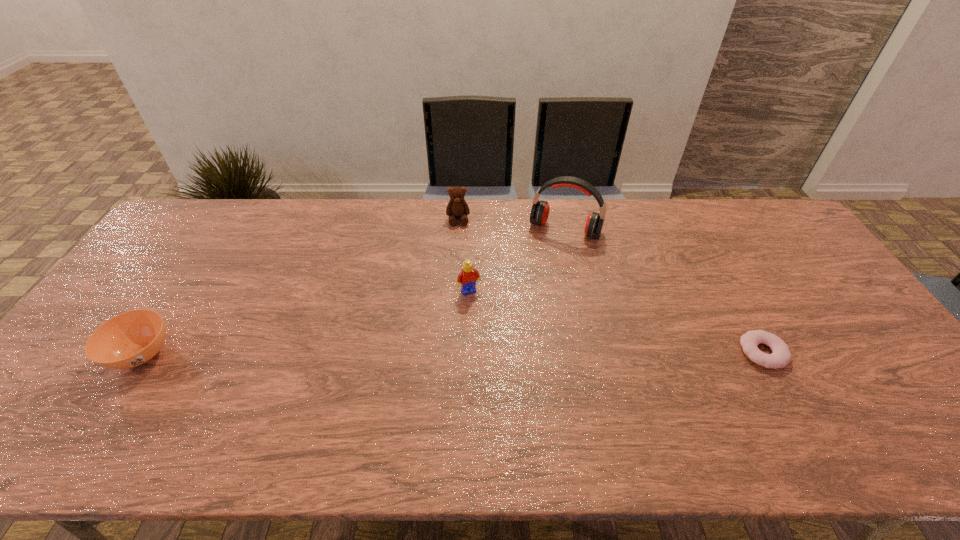
Locate an element on the screen. This screenshot has height=540, width=960. vacant region located on the face of the teddy bear is located at coordinates (462, 267).

At what (x,y) coordinates should I click in order to perform the action: click on free space located on the face of the teddy bear. Please return your answer as a coordinate pair (x, y). Image resolution: width=960 pixels, height=540 pixels. Looking at the image, I should click on (460, 248).

At what (x,y) coordinates should I click in order to perform the action: click on free space located on the face of the teddy bear. Please return your answer as a coordinate pair (x, y). The image size is (960, 540). Looking at the image, I should click on (465, 303).

You are a GUI agent. You are given a task and a screenshot of the screen. Output one action in this format:
    pyautogui.click(x=<x>, y=<y>)
    Task: Click on the vacant area situated on the front-facing side of the Lego
    This screenshot has height=540, width=960.
    Given the screenshot: What is the action you would take?
    pyautogui.click(x=486, y=322)

I want to click on vacant space situated on the front-facing side of the Lego, so click(514, 378).

This screenshot has width=960, height=540. I want to click on free spot located on the front-facing side of the Lego, so 515,381.

Where is `free space located 0.280m on the ear cups of the earphone`? The width and height of the screenshot is (960, 540). free space located 0.280m on the ear cups of the earphone is located at coordinates (529, 303).

Locate an element on the screen. The width and height of the screenshot is (960, 540). vacant area located on the ear cups of the earphone is located at coordinates (546, 263).

Find the location of `free spot located on the ear cups of the earphone`. free spot located on the ear cups of the earphone is located at coordinates (545, 265).

Locate an element on the screen. This screenshot has width=960, height=540. teddy bear positioned at the far edge is located at coordinates (457, 207).